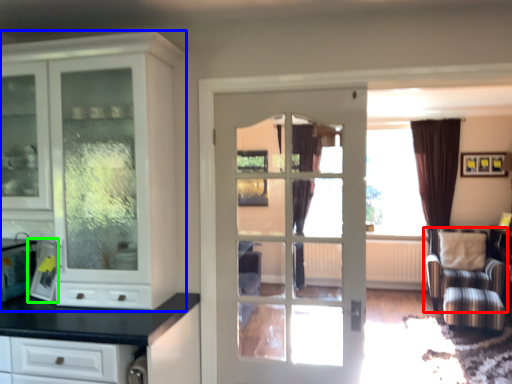
Question: Which object is positioned closest to chair (highlighted by a red box)? Select from cabinetry (highlighted by a blue box) and appliance (highlighted by a green box).

Choices:
 (A) cabinetry
 (B) appliance

Answer: (A)